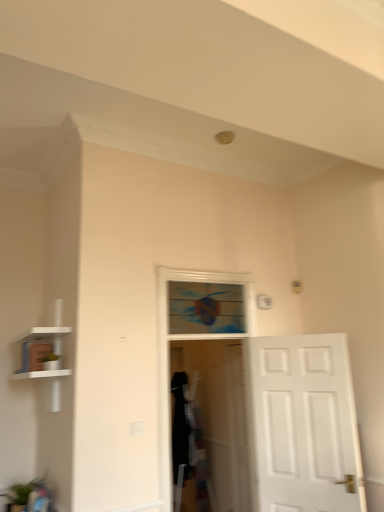
Question: Is wooden stained window at center smaller than white matte bookshelf at left?

Choices:
 (A) no
 (B) yes

Answer: (B)

Question: Is wooden stained window at center behind white matte bookshelf at left?

Choices:
 (A) yes
 (B) no

Answer: (A)

Question: Is wooden stained window at center directly adjacent to white matte bookshelf at left?

Choices:
 (A) no
 (B) yes

Answer: (A)

Question: Considering the relative positions of wooden stained window at center and white matte bookshelf at left in the image provided, is wooden stained window at center to the left of white matte bookshelf at left from the viewer's perspective?

Choices:
 (A) yes
 (B) no

Answer: (B)

Question: From a real-world perspective, is wooden stained window at center physically below white matte bookshelf at left?

Choices:
 (A) yes
 (B) no

Answer: (B)

Question: Is white matte bookshelf at left bigger or smaller than transparent plastic screen door at center?

Choices:
 (A) big
 (B) small

Answer: (A)

Question: In terms of width, does white matte bookshelf at left look wider or thinner when compared to transparent plastic screen door at center?

Choices:
 (A) wide
 (B) thin

Answer: (A)

Question: Relative to transparent plastic screen door at center, is white matte bookshelf at left in front or behind?

Choices:
 (A) front
 (B) behind

Answer: (A)

Question: Visually, is white matte bookshelf at left positioned to the left or to the right of transparent plastic screen door at center?

Choices:
 (A) right
 (B) left

Answer: (B)

Question: Relative to white matte door at center, is wooden stained window at center in front or behind?

Choices:
 (A) behind
 (B) front

Answer: (A)

Question: Considering the positions of wooden stained window at center and white matte door at center in the image, is wooden stained window at center taller or shorter than white matte door at center?

Choices:
 (A) short
 (B) tall

Answer: (A)

Question: Visually, is wooden stained window at center positioned to the left or to the right of white matte door at center?

Choices:
 (A) right
 (B) left

Answer: (B)

Question: From a real-world perspective, is wooden stained window at center physically located above or below white matte door at center?

Choices:
 (A) above
 (B) below

Answer: (A)

Question: In terms of width, does wooden stained window at center look wider or thinner when compared to transparent plastic screen door at center?

Choices:
 (A) thin
 (B) wide

Answer: (A)

Question: From a real-world perspective, is wooden stained window at center above or below transparent plastic screen door at center?

Choices:
 (A) below
 (B) above

Answer: (B)